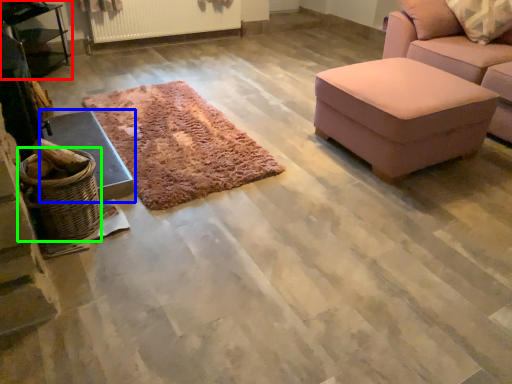
Question: Based on their relative distances, which object is nearer to table (highlighted by a red box)? Choose from furniture (highlighted by a blue box) and basket (highlighted by a green box).

Choices:
 (A) furniture
 (B) basket

Answer: (A)